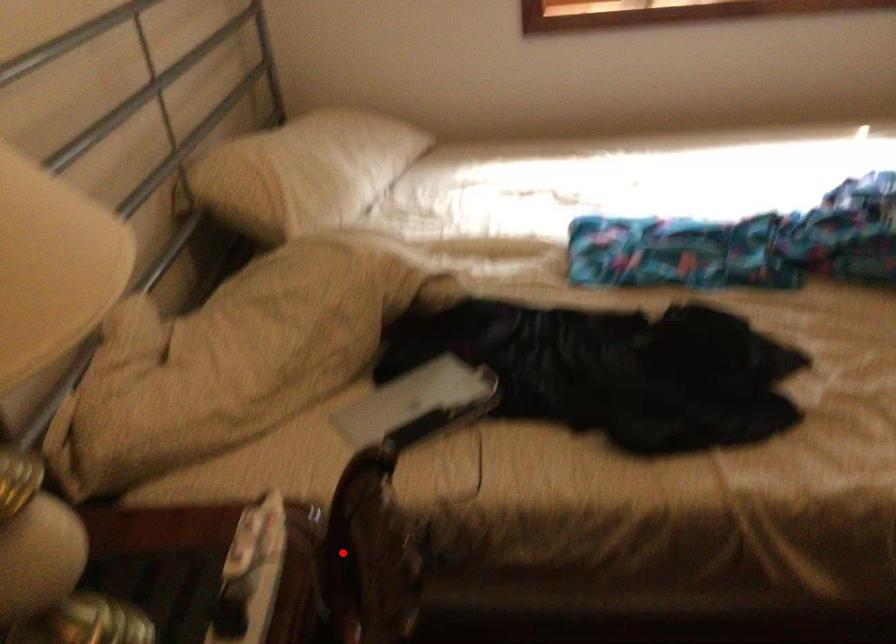
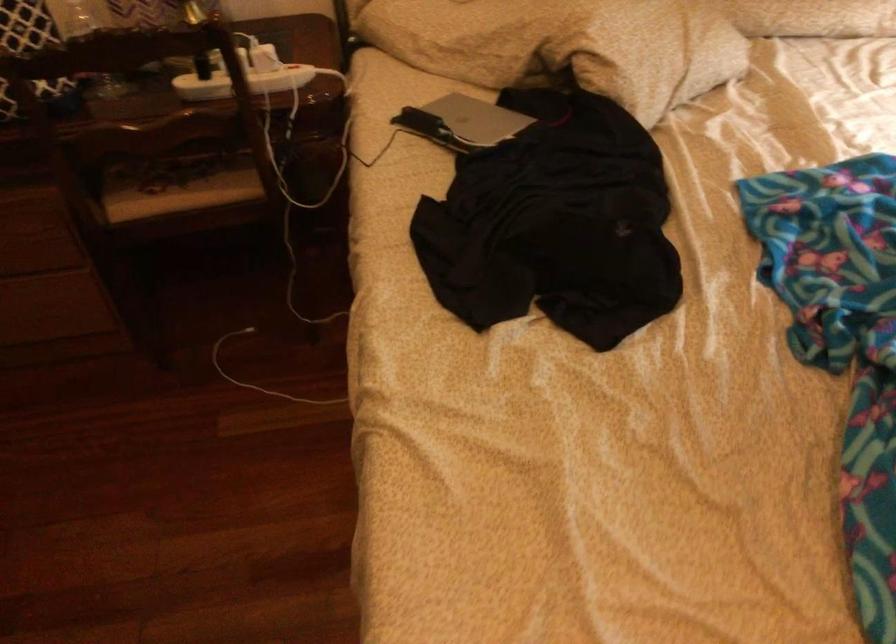
Locate, in the second image, the point that corresponds to the highlighted location in the first image.

(243, 82)